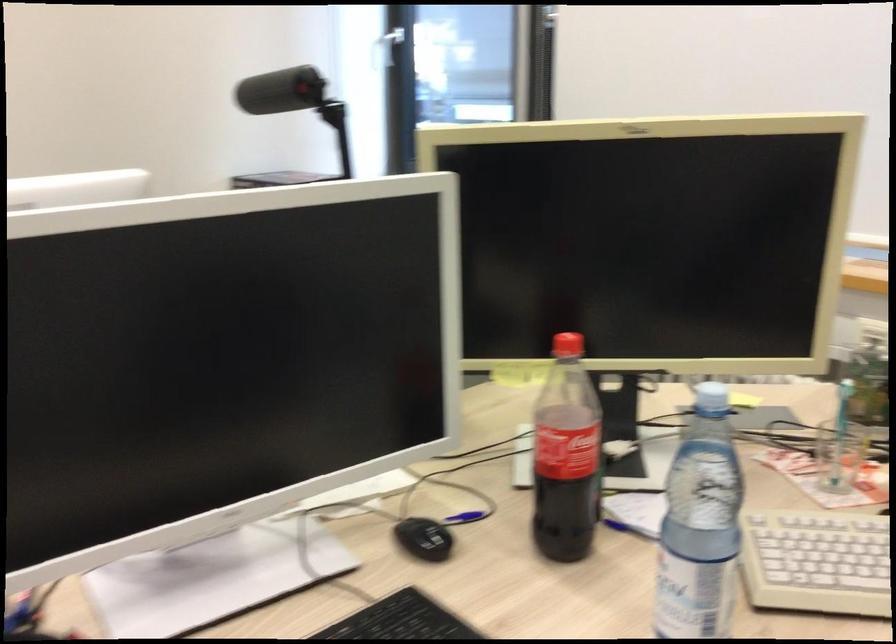
The height and width of the screenshot is (644, 896). I want to click on red bottle cap, so click(x=565, y=456).